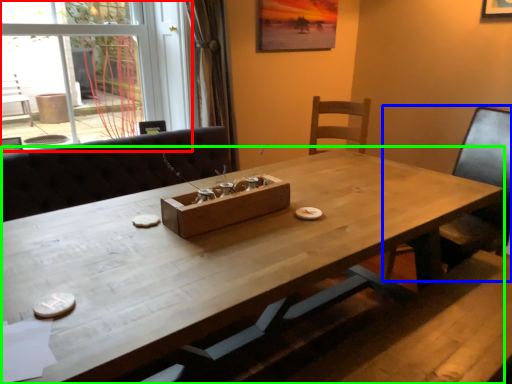
Question: Which is farther away from glass door (highlighted by a red box)? chair (highlighted by a blue box) or table (highlighted by a green box)?

Choices:
 (A) chair
 (B) table

Answer: (A)